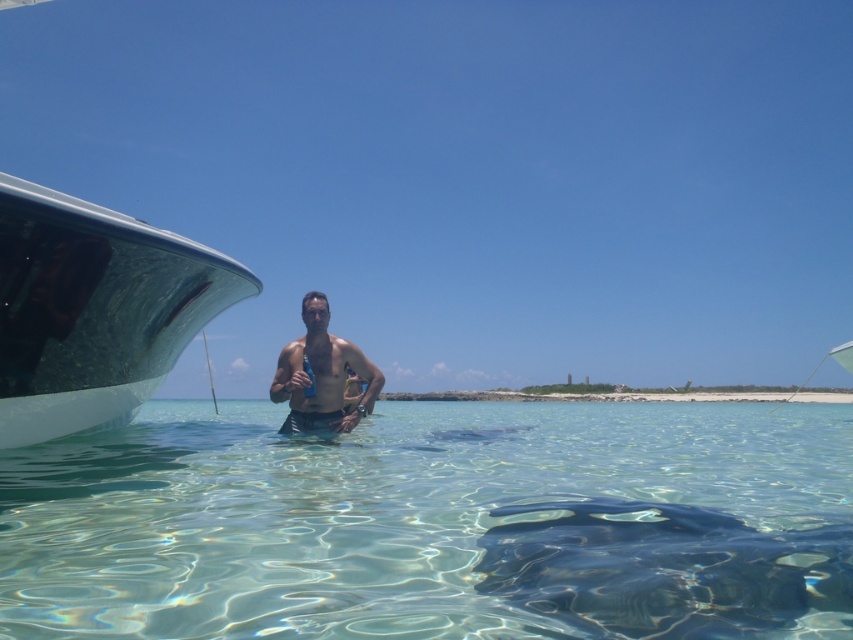
You are a photographer trying to capture the smooth skin man at center and the clear water at center in a single shot. Based on their sizes, which one would you focus on to ensure it fills more of the frame?

The clear water at center is larger in size than the smooth skin man at center, so focusing on the clear water at center would fill more of the frame.

You are a photographer trying to capture the shiny white boat at left and the smooth skin man at center in the same frame. Based on their positions, which object is closer to the camera?

The shiny white boat at left is positioned over the smooth skin man at center, indicating it is closer to the camera.